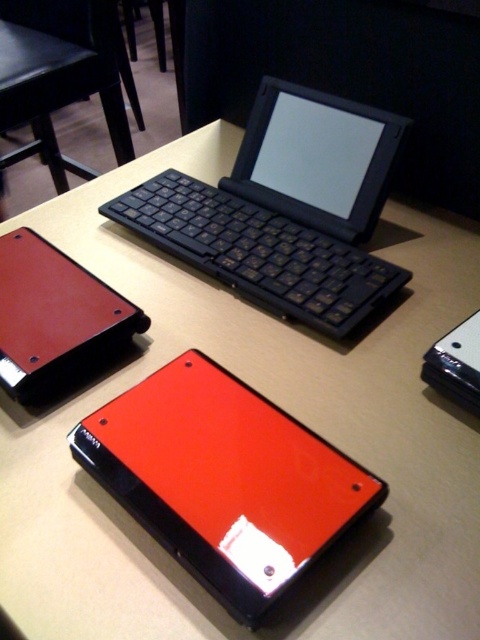
Can you confirm if black matte keyboard at center is positioned to the right of glossy leather tablet at lower left?

Indeed, black matte keyboard at center is positioned on the right side of glossy leather tablet at lower left.

Who is more distant from viewer, (331, 305) or (43, 333)?

Positioned behind is point (331, 305).

Does point (275, 268) lie in front of point (3, 328)?

No, (275, 268) is behind (3, 328).

Identify the location of black matte keyboard at center. (285, 209).

Between glossy red tablet at center and matte black keyboard at upper center, which one has more height?

With more height is matte black keyboard at upper center.

Measure the distance between glossy red tablet at center and matte black keyboard at upper center.

A distance of 1.33 meters exists between glossy red tablet at center and matte black keyboard at upper center.

Does point (208, 358) come closer to viewer compared to point (23, 108)?

Yes.

At what (x,y) coordinates should I click in order to perform the action: click on glossy red tablet at center. Please return your answer as a coordinate pair (x, y). The height and width of the screenshot is (640, 480). Looking at the image, I should click on (224, 480).

Does glossy red tablet at center appear on the left side of black matte keyboard at center?

Yes, glossy red tablet at center is to the left of black matte keyboard at center.

Is glossy red tablet at center positioned in front of black matte keyboard at center?

That is True.

At what (x,y) coordinates should I click in order to perform the action: click on glossy red tablet at center. Please return your answer as a coordinate pair (x, y). The height and width of the screenshot is (640, 480). Looking at the image, I should click on (224, 480).